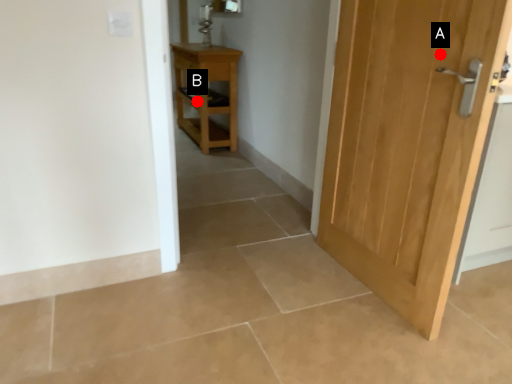
Question: Two points are circled on the image, labeled by A and B beside each circle. Which point is farther from the camera taking this photo?

Choices:
 (A) A is further
 (B) B is further

Answer: (B)